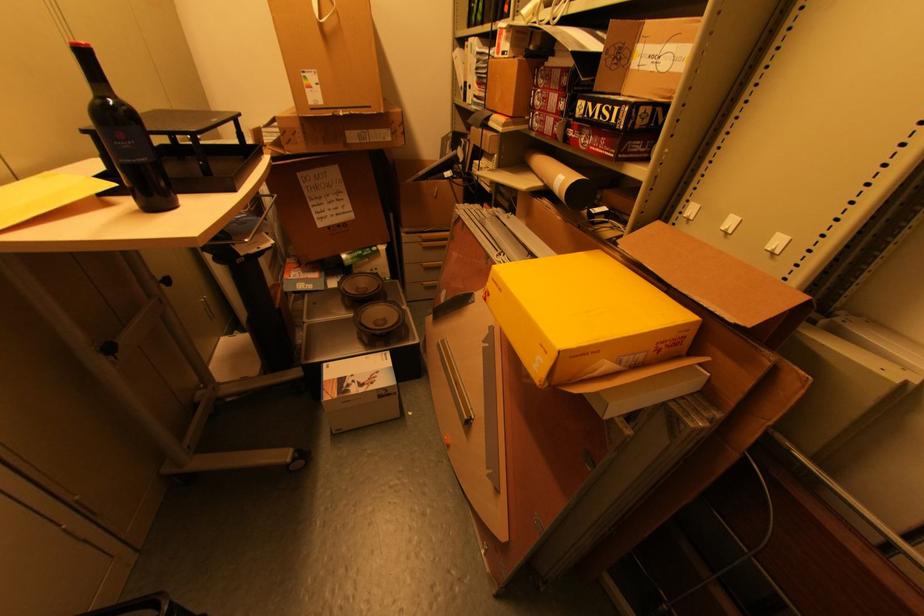
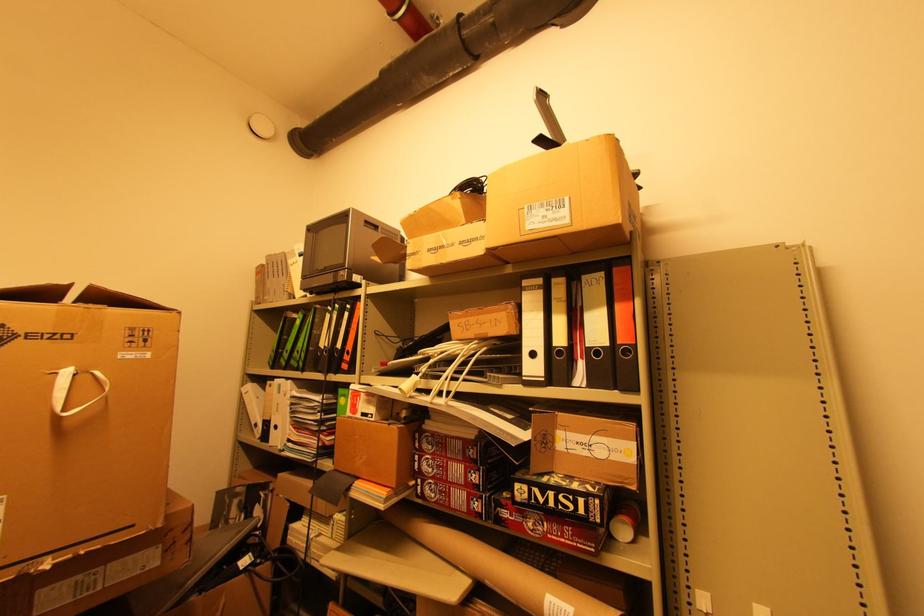
Where in the second image is the point corresponding to [649,156] from the first image?

(611, 535)